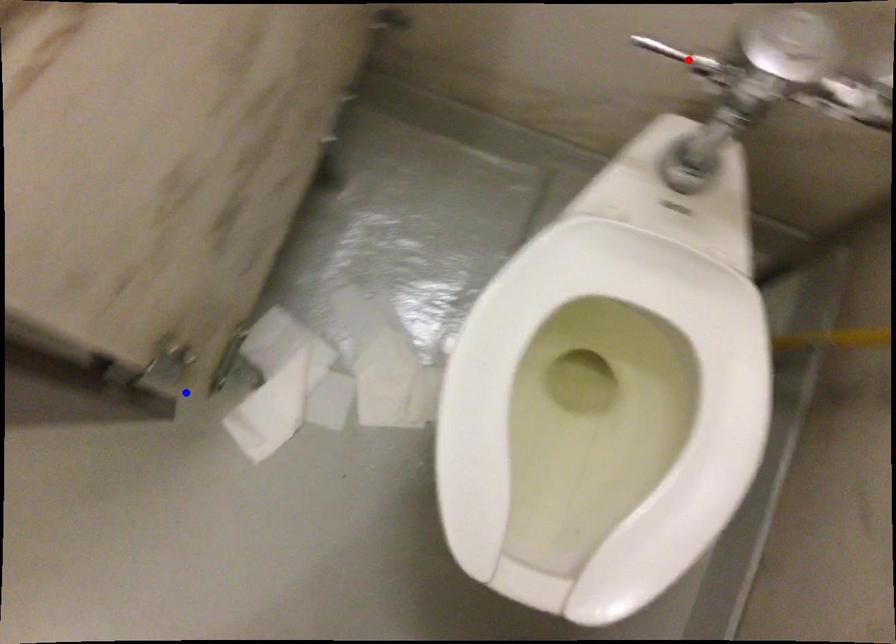
Question: Which of the two points in the image is closer to the camera?

Choices:
 (A) Blue point is closer.
 (B) Red point is closer.

Answer: (B)